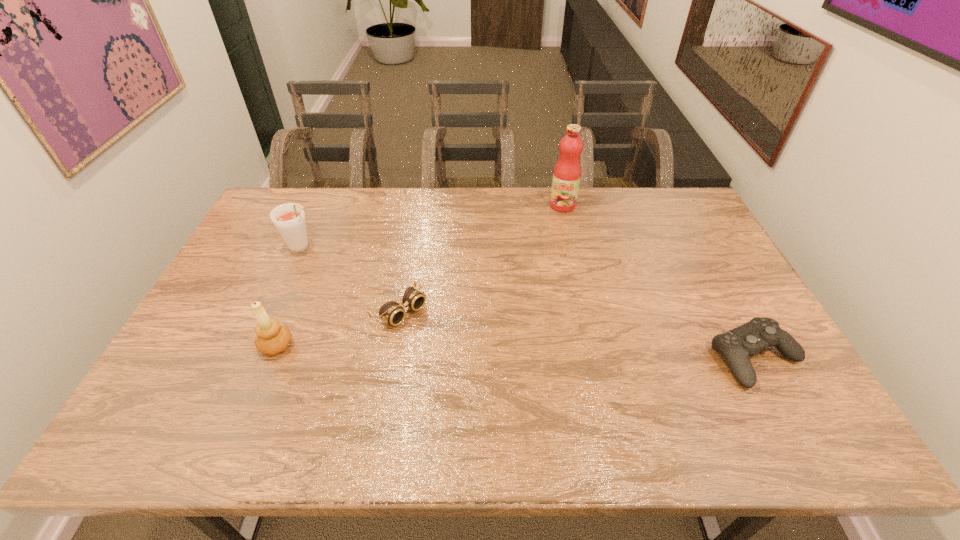
Identify which object is the closest to the rightmost object. Please provide its 2D coordinates. Your answer should be formatted as a tuple, i.e. [(x, y)], where the tuple contains the x and y coordinates of a point satisfying the conditions above.

[(567, 172)]

Find the location of a particular element. vacant area that satisfies the following two spatial constraints: 1. on the back side of the farthest object; 2. on the right side of the candle_holder is located at coordinates (334, 205).

Image resolution: width=960 pixels, height=540 pixels. I want to click on free spot that satisfies the following two spatial constraints: 1. on the back side of the candle_holder; 2. on the right side of the tallest object, so point(334,205).

In order to click on vacant space that satisfies the following two spatial constraints: 1. on the front side of the candle_holder; 2. on the left side of the second farthest object in this screenshot , I will do 259,346.